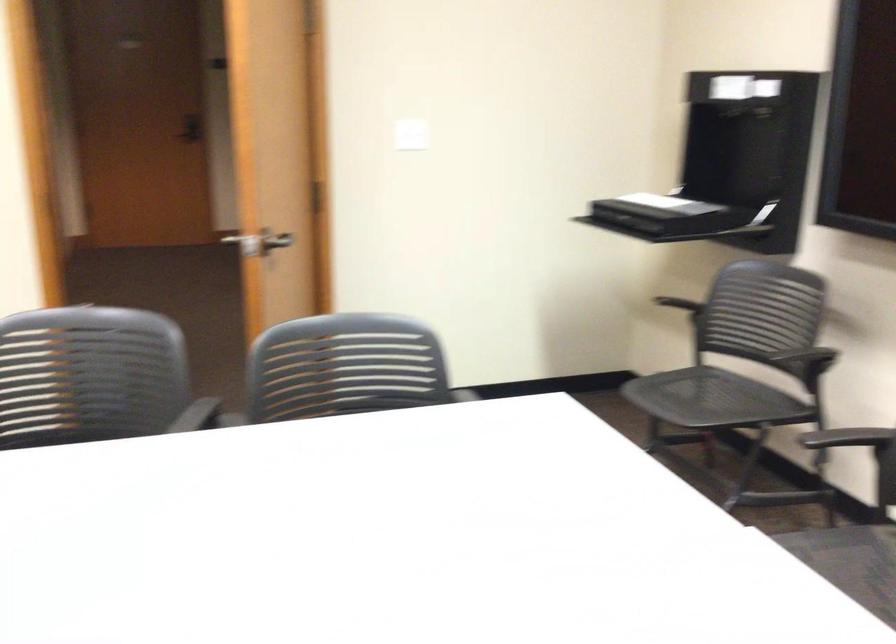
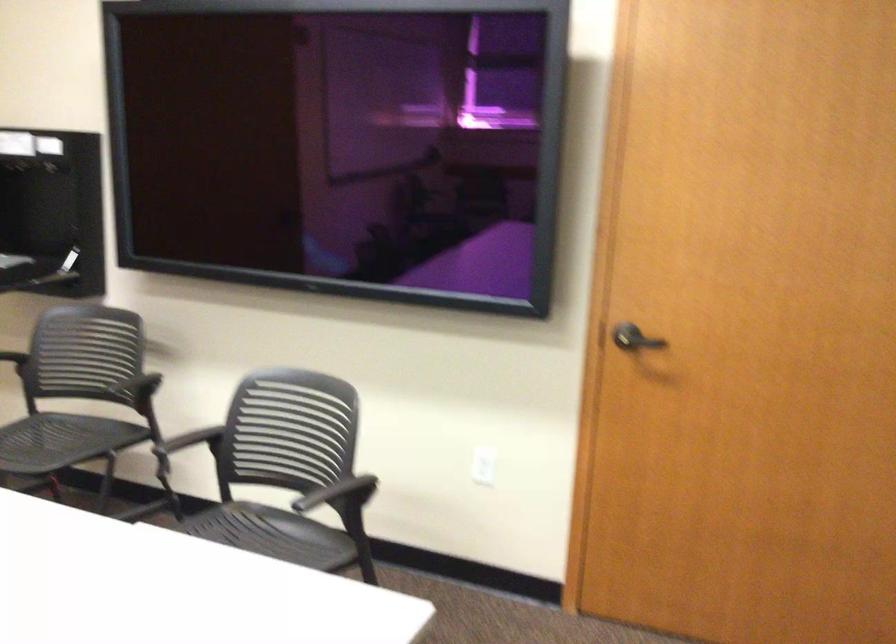
Find the pixel in the second image that matches point (686, 310) in the first image.

(13, 357)